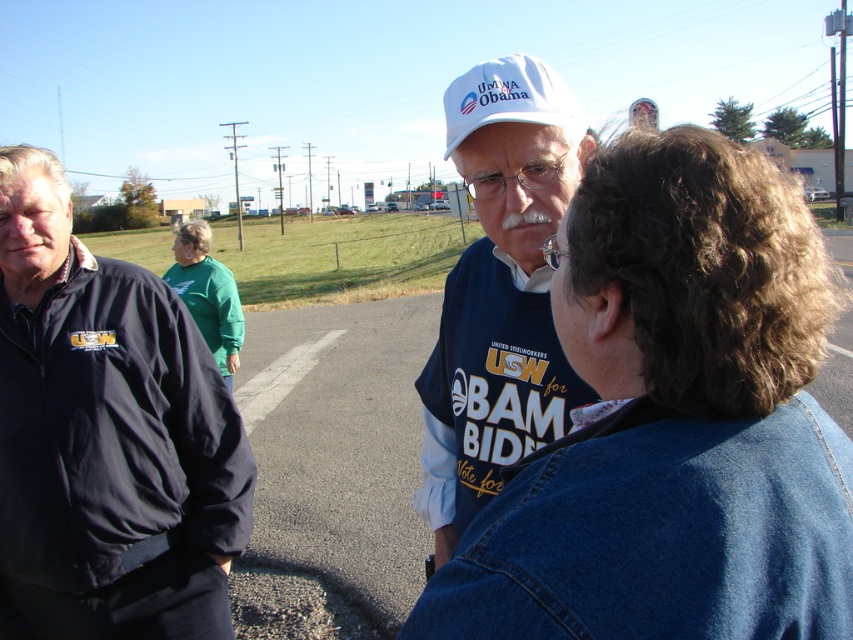
Question: Does denim jacket at upper right appear over white matte hat at center?

Choices:
 (A) yes
 (B) no

Answer: (A)

Question: Can you confirm if dark blue jacket at left is thinner than white matte baseball hat at upper center?

Choices:
 (A) no
 (B) yes

Answer: (A)

Question: Which is farther from the dark blue jacket at left?

Choices:
 (A) white matte baseball hat at upper center
 (B) denim jacket at upper right
 (C) green fleece jacket at center
 (D) white matte hat at center

Answer: (B)

Question: Which of the following is the closest to the observer?

Choices:
 (A) (68, 273)
 (B) (461, 109)
 (C) (647, 275)

Answer: (C)

Question: Among these points, which one is farthest from the camera?

Choices:
 (A) (506, 435)
 (B) (793, 490)

Answer: (A)

Question: Is denim jacket at upper right thinner than green fleece jacket at center?

Choices:
 (A) yes
 (B) no

Answer: (A)